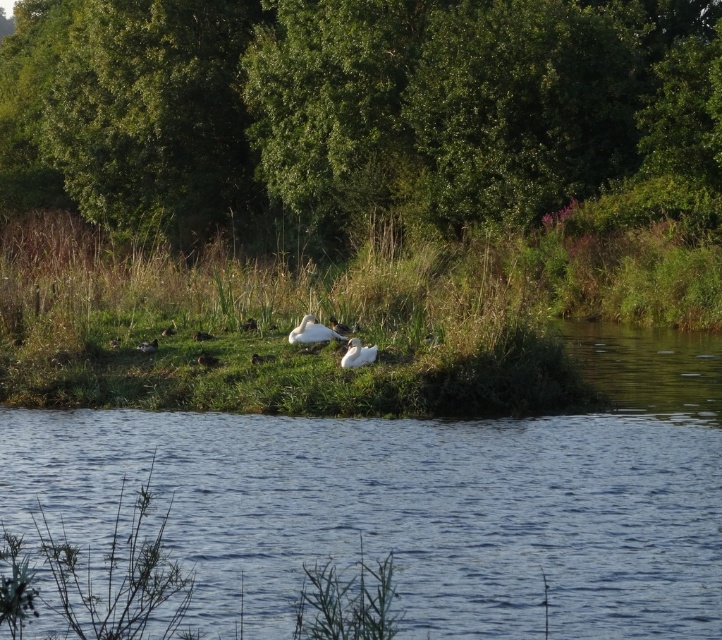
Can you confirm if blue water at center is taller than white fluffy goose at center?

Indeed, blue water at center has a greater height compared to white fluffy goose at center.

Looking at this image, does blue water at center lie in front of white fluffy goose at center?

Yes, it is.

Describe the element at coordinates (425, 499) in the screenshot. I see `blue water at center` at that location.

I want to click on blue water at center, so click(x=425, y=499).

Who is more distant from viewer, (427, 17) or (370, 362)?

The point (427, 17) is more distant.

Who is positioned more to the right, green leafy tree at upper center or white fluffy goose at center?

Positioned to the right is white fluffy goose at center.

Image resolution: width=722 pixels, height=640 pixels. I want to click on green leafy tree at upper center, so click(349, 108).

In the scene shown: Who is higher up, green leafy tree at upper center or green grass at center?

green leafy tree at upper center is above.

Who is more forward, (310, 99) or (469, 400)?

Point (469, 400) is more forward.

I want to click on green leafy tree at upper center, so click(349, 108).